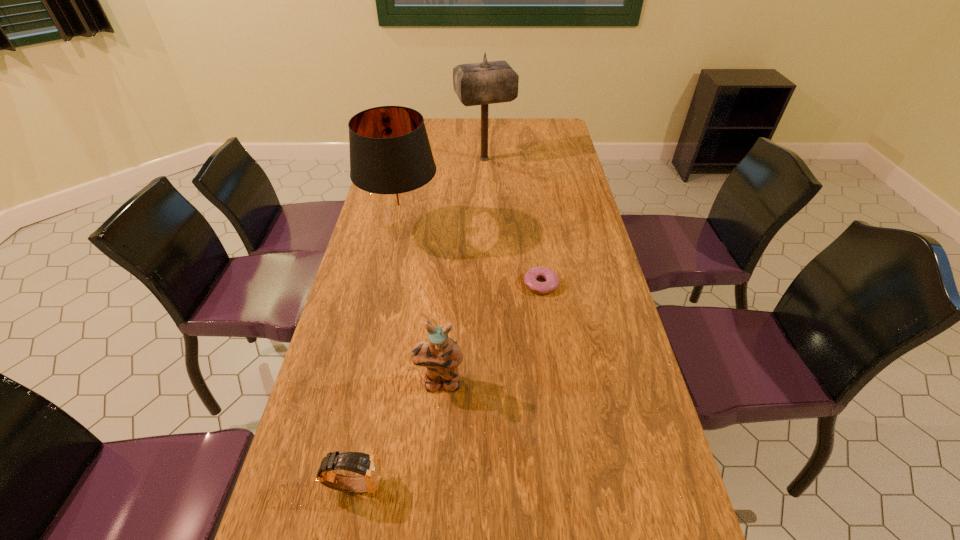
What are the coordinates of `vacant region that satisfies the following two spatial constraints: 1. on the front-facing side of the second nearest object; 2. on the face of the watch` in the screenshot? It's located at (432, 484).

What are the coordinates of `free point that satisfies the following two spatial constraints: 1. on the front side of the farthest object; 2. on the right side of the third farthest object` in the screenshot? It's located at (487, 284).

This screenshot has width=960, height=540. I want to click on vacant space that satisfies the following two spatial constraints: 1. on the front side of the farthest object; 2. on the face of the nearest object, so click(490, 484).

This screenshot has width=960, height=540. I want to click on vacant area that satisfies the following two spatial constraints: 1. on the front-facing side of the third shortest object; 2. on the face of the second shortest object, so click(x=432, y=484).

Where is `free space that satisfies the following two spatial constraints: 1. on the front-facing side of the third tallest object; 2. on the face of the second shortest object`? free space that satisfies the following two spatial constraints: 1. on the front-facing side of the third tallest object; 2. on the face of the second shortest object is located at coordinates (432, 484).